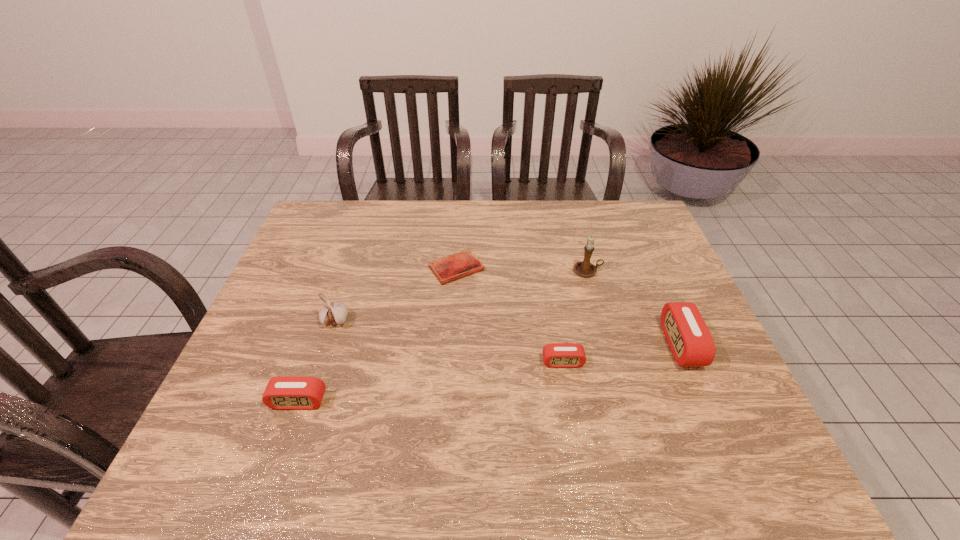
Where is `the nearest alarm clock`? Image resolution: width=960 pixels, height=540 pixels. the nearest alarm clock is located at coordinates (282, 393).

You are a GUI agent. You are given a task and a screenshot of the screen. Output one action in this format:
    pyautogui.click(x=<x>, y=<y>)
    Task: Click on the second shortest alarm clock
    
    Given the screenshot: What is the action you would take?
    pyautogui.click(x=282, y=393)

This screenshot has width=960, height=540. I want to click on the shortest alarm clock, so click(x=555, y=355).

The width and height of the screenshot is (960, 540). Find the location of `the second alarm clock from right to left`. the second alarm clock from right to left is located at coordinates point(555,355).

Locate an element on the screen. This screenshot has height=540, width=960. the rightmost alarm clock is located at coordinates (690, 341).

This screenshot has height=540, width=960. In order to click on the tallest alarm clock in this screenshot , I will do `click(690, 341)`.

The height and width of the screenshot is (540, 960). I want to click on candle holder, so click(x=584, y=268).

What are the coordinates of `the tallest object` in the screenshot? It's located at (584, 268).

Find the location of a particular element. This screenshot has height=540, width=960. garlic is located at coordinates coord(335,312).

Identify the location of the shortest object. The image size is (960, 540). (453, 267).